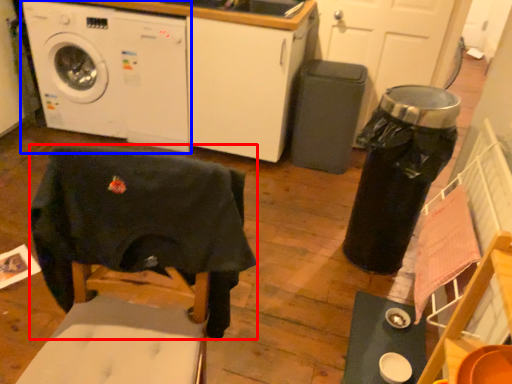
Question: Which object appears closest to the camera in this image, swivel chair (highlighted by a red box) or washing machine (highlighted by a blue box)?

Choices:
 (A) swivel chair
 (B) washing machine

Answer: (A)